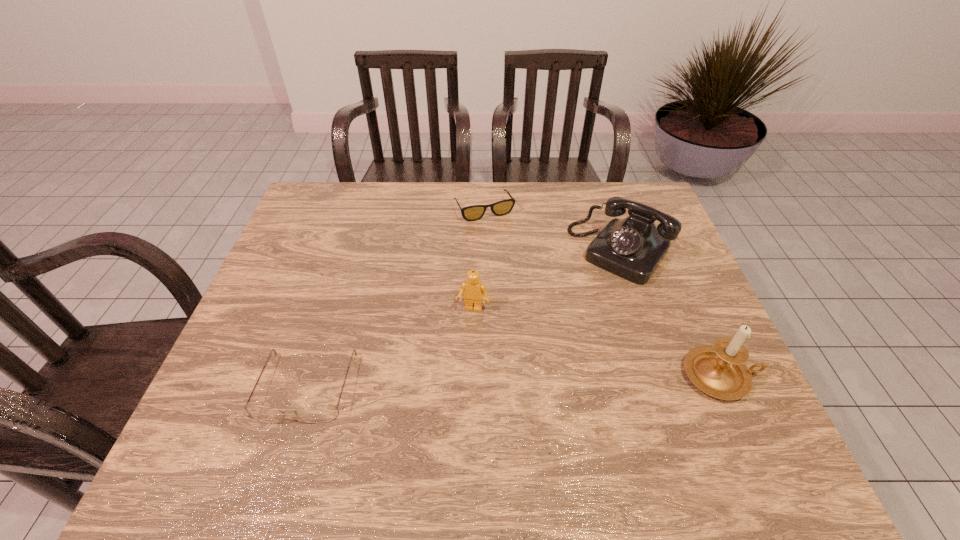
Where is `candle holder that is at the right edge`? The image size is (960, 540). candle holder that is at the right edge is located at coordinates (719, 371).

What are the coordinates of `telephone located in the right edge section of the desktop` in the screenshot? It's located at (632, 248).

Where is `object that is at the near left corner`? object that is at the near left corner is located at coordinates (323, 413).

The width and height of the screenshot is (960, 540). What are the coordinates of `object present at the far right corner` in the screenshot? It's located at (632, 248).

Where is `object present at the near right corner`? object present at the near right corner is located at coordinates pos(719,371).

What are the coordinates of `free point at the far edge` in the screenshot? It's located at (x=403, y=185).

Find the location of a particular element. This screenshot has height=540, width=960. vacant space at the near edge of the desktop is located at coordinates [317, 393].

Find the location of a particular element. The height and width of the screenshot is (540, 960). vacant space at the left edge of the desktop is located at coordinates (246, 350).

In the image, there is a desktop. At what (x,y) coordinates should I click in order to perform the action: click on vacant space at the right edge. Please return your answer as a coordinate pair (x, y). Looking at the image, I should click on (665, 358).

The height and width of the screenshot is (540, 960). Identify the location of vacant space at the near left corner of the desktop. (210, 414).